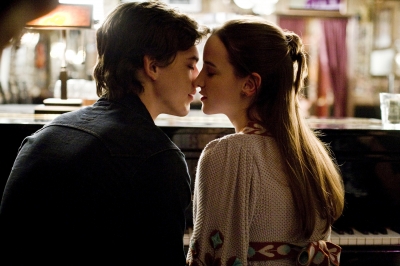
Where is `counter`? counter is located at coordinates (183, 127).